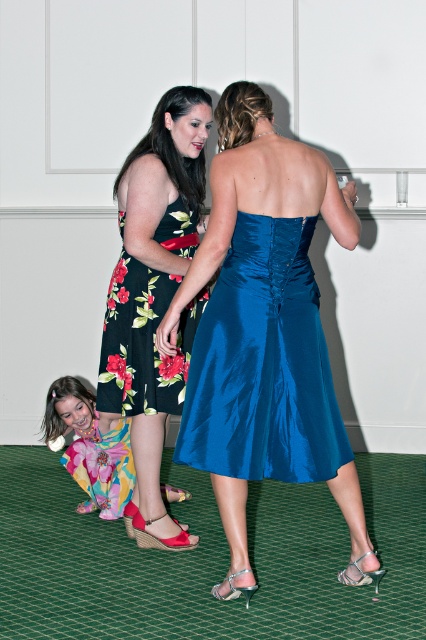
From the picture: What are the coordinates of the floral satin dress at center?

The floral satin dress at center is located at coordinates point [155,294].

You are standing in the room and want to take a photo of the shiny blue dress at center without moving any objects. Can you do so from your current position?

Yes, you can take a photo of the shiny blue dress at center from your current position since it is located at point (262,364) which is within the visible area of the room.

You are a photographer adjusting your camera settings to capture the scene. You notice the shiny blue dress at center and the red suede sandal at lower left. Which object is closer to the camera?

The shiny blue dress at center is positioned over the red suede sandal at lower left, meaning it is closer to the camera.